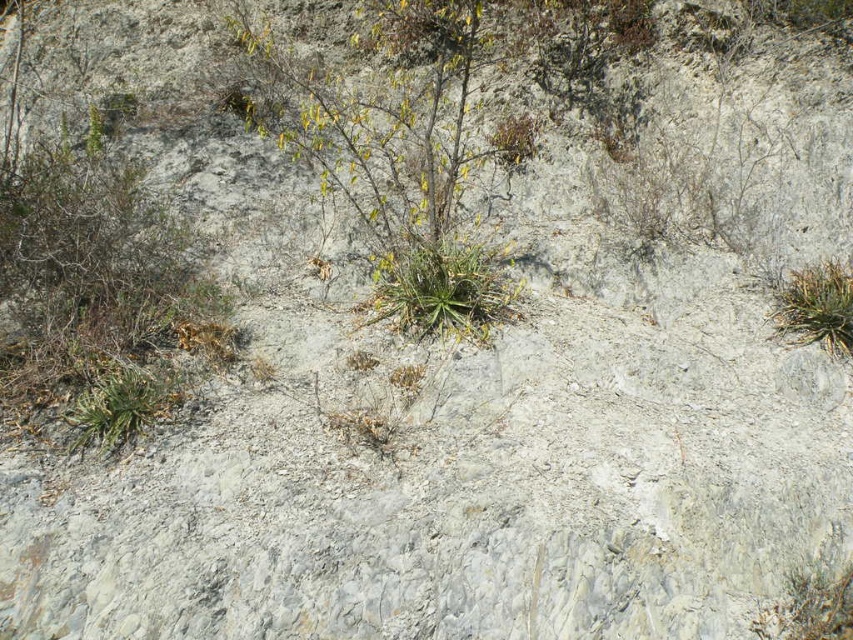
Does green leafy plant at lower left come in front of green leafy plant at lower right?

That is True.

Find the location of a particular element. Image resolution: width=853 pixels, height=640 pixels. green leafy plant at lower left is located at coordinates (119, 406).

At what (x,y) coordinates should I click in order to perform the action: click on green leafy plant at lower left. Please return your answer as a coordinate pair (x, y). Image resolution: width=853 pixels, height=640 pixels. Looking at the image, I should click on (119, 406).

The height and width of the screenshot is (640, 853). I want to click on green leafy plant at lower left, so click(119, 406).

Does green leafy plant at center have a smaller size compared to green leafy plant at lower left?

No.

The image size is (853, 640). What do you see at coordinates (442, 291) in the screenshot?
I see `green leafy plant at center` at bounding box center [442, 291].

Where is `green leafy plant at center`? The height and width of the screenshot is (640, 853). green leafy plant at center is located at coordinates (442, 291).

The width and height of the screenshot is (853, 640). I want to click on green leafy plant at center, so click(442, 291).

Can you confirm if green leafy plant at center is positioned to the left of green leafy plant at lower right?

Correct, you'll find green leafy plant at center to the left of green leafy plant at lower right.

I want to click on green leafy plant at center, so click(442, 291).